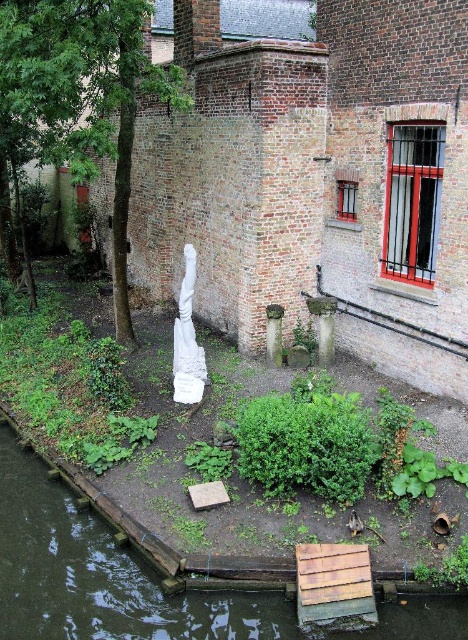
Question: Which object is positioned farthest from the clear water at dock lower left?

Choices:
 (A) green leafy tree at center-left
 (B) white marble column at center

Answer: (A)

Question: Which object is positioned closest to the white marble column at center?

Choices:
 (A) green leafy tree at center-left
 (B) clear water at dock lower left
 (C) wooden planks at lower center
 (D) white marble statue at center

Answer: (A)

Question: Does wooden planks at lower center have a greater width compared to white marble column at center?

Choices:
 (A) no
 (B) yes

Answer: (B)

Question: Does clear water at dock lower left appear over wooden planks at lower center?

Choices:
 (A) yes
 (B) no

Answer: (B)

Question: Is white marble statue at center below clear water at dock lower left?

Choices:
 (A) no
 (B) yes

Answer: (A)

Question: Which object is the closest to the wooden planks at lower center?

Choices:
 (A) white marble statue at center
 (B) clear water at dock lower left

Answer: (B)